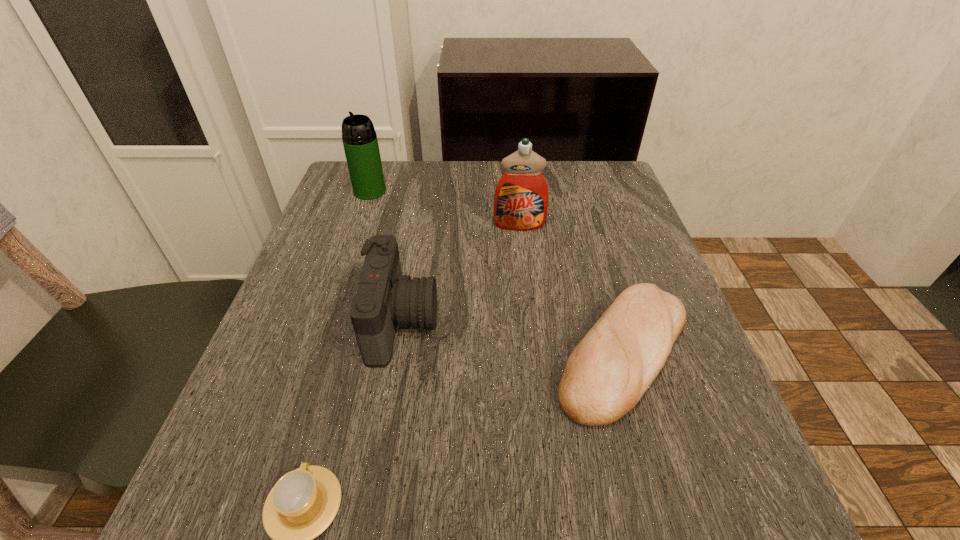
I want to click on the farthest object, so click(x=360, y=142).

Identify the location of detergent. (521, 198).

I want to click on camera, so click(385, 299).

Identify the location of the fourth tallest object. (607, 373).

The width and height of the screenshot is (960, 540). I want to click on free point located from the spout of the farthest object, so click(x=337, y=289).

I want to click on vacant space located on the front surface of the fourth nearest object, so click(x=532, y=336).

You are a GUI agent. You are given a task and a screenshot of the screen. Output one action in this format:
    pyautogui.click(x=<x>, y=<y>)
    Task: Click on the free location located at the lens of the camera
    
    Given the screenshot: What is the action you would take?
    pyautogui.click(x=481, y=322)

I want to click on blank space located on the left of the bread, so click(450, 353).

This screenshot has width=960, height=540. What are the coordinates of `object that is at the far edge` in the screenshot? It's located at (360, 142).

Locate an element on the screen. object at the left edge is located at coordinates (360, 142).